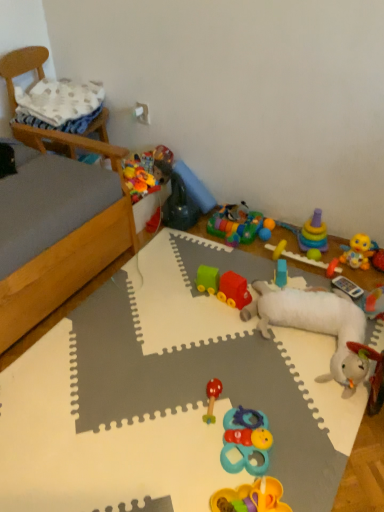
In order to click on vacant area located to the right-hand side of blue rubber teething ring at center, the 10th toy in the top-to-bottom sequence in this screenshot , I will do (312, 440).